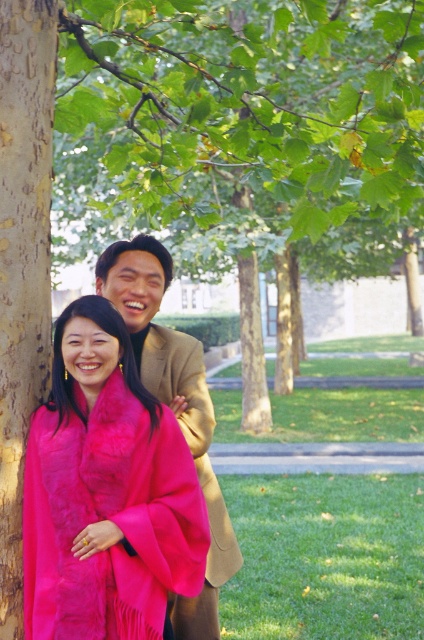
You are a photographer adjusting your camera settings to focus on two points in the scene. The first point is point [273,211] and the second is point [78,342]. Which point is closer to the camera lens?

Point [273,211] is further to the camera than point [78,342], so the first point is closer to the camera lens.

You are a photographer trying to capture the fuzzy pink scarf at left and the smooth bark tree trunk at left in the same frame. Which object is wider?

The fuzzy pink scarf at left is wider than the smooth bark tree trunk at left.